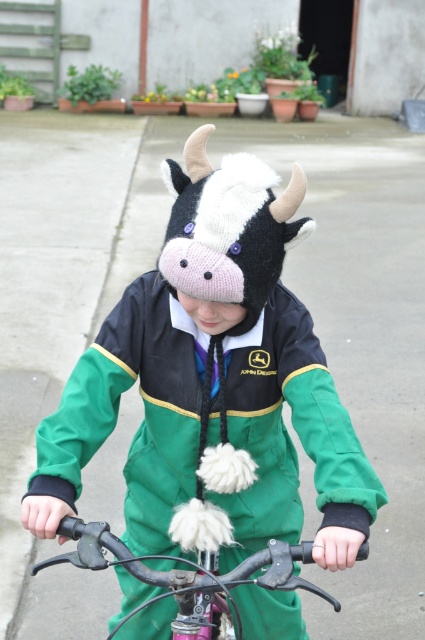
Between knitted woolen hat at center and metallic silver bicycle handlebars at center, which one is positioned lower?

metallic silver bicycle handlebars at center

Between knitted woolen hat at center and metallic silver bicycle handlebars at center, which one has less height?

metallic silver bicycle handlebars at center

Which is behind, point (280, 321) or point (189, 577)?

Positioned behind is point (280, 321).

You are a GUI agent. You are given a task and a screenshot of the screen. Output one action in this format:
    pyautogui.click(x=<x>, y=<y>)
    Task: Click on the knitted woolen hat at center
    
    Given the screenshot: What is the action you would take?
    pyautogui.click(x=214, y=378)